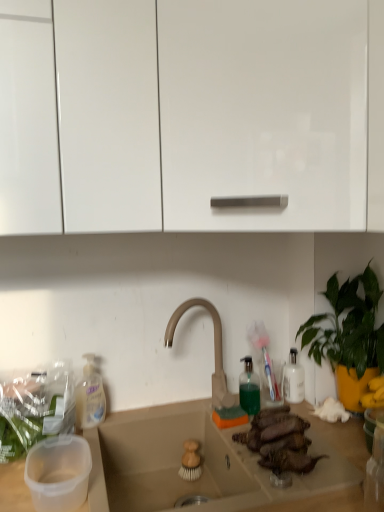
Question: From a real-world perspective, relative to beige matte faucet at center, is glossy white cabinet at upper center, the second cabinetry viewed from the left, vertically above or below?

Choices:
 (A) above
 (B) below

Answer: (A)

Question: Is point (64, 61) closer or farther from the camera than point (211, 304)?

Choices:
 (A) farther
 (B) closer

Answer: (B)

Question: Which object is positioned closest to the glossy white cabinet at upper center, which is the 1th cabinetry from right to left?

Choices:
 (A) beige matte faucet at center
 (B) green translucent bottle at center-right, arranged as the second bottle when viewed from the left
 (C) green leafy plant at right
 (D) white glossy cabinet at upper left, the first cabinetry in the left-to-right sequence
 (E) brown matte meat at center

Answer: (D)

Question: Estimate the real-world distances between objects in this image. Which object is farther from the white glossy cabinet at upper left, arranged as the second cabinetry when viewed from the right?

Choices:
 (A) glossy white cabinet at upper center, which is the 1th cabinetry from right to left
 (B) brown matte meat at center
 (C) beige matte countertop at center
 (D) green translucent bottle at center-right, arranged as the second bottle when viewed from the left
 (E) green leafy plant at right

Answer: (D)